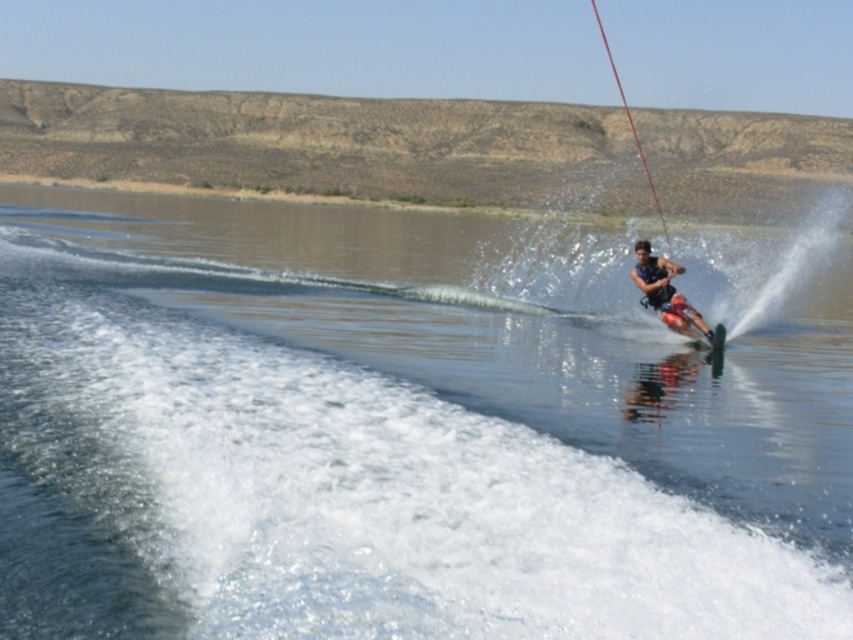
The height and width of the screenshot is (640, 853). What do you see at coordinates (412, 426) in the screenshot?
I see `clear water at center` at bounding box center [412, 426].

Who is positioned more to the left, clear water at center or matte black life vest at center?

clear water at center

Identify the location of clear water at center. Image resolution: width=853 pixels, height=640 pixels. (412, 426).